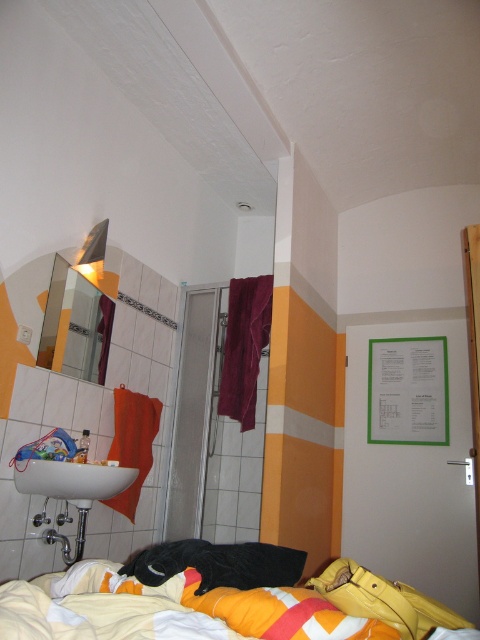
You are standing in the room and want to move from the yellow fabric bed at lower center to the brushed metal faucet at sink left. Which direction should you move to get closer to the faucet?

Since the yellow fabric bed at lower center is closer to the viewer than the brushed metal faucet at sink left, you should move backward to get closer to the faucet.

You are trying to clean the clear glass mirror at upper left and the brushed metal faucet at sink left. Which object requires a larger cleaning area?

The clear glass mirror at upper left requires a larger cleaning area because it is larger in size than the brushed metal faucet at sink left.